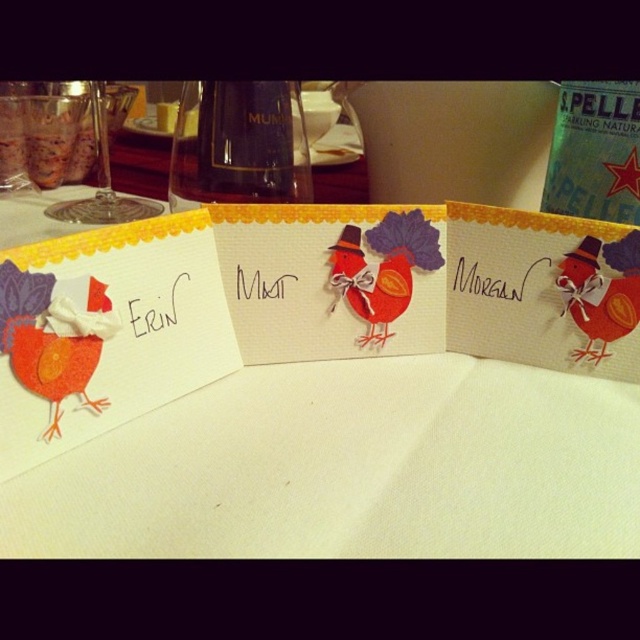
Question: Which object is the farthest from the black ink name at center?

Choices:
 (A) black ink name at upper left
 (B) matte orange felt chicken at left

Answer: (B)

Question: Can you confirm if white paper card at center is positioned below matte paper chicken at center?

Choices:
 (A) yes
 (B) no

Answer: (A)

Question: Is white paper card at center thinner than matte orange felt chicken at left?

Choices:
 (A) no
 (B) yes

Answer: (A)

Question: Which point appears farthest from the camera in this image?

Choices:
 (A) (241, 273)
 (B) (35, 417)

Answer: (A)

Question: Which object appears closest to the camera in this image?

Choices:
 (A) black ink name at upper left
 (B) matte paper chicken at center
 (C) black ink name at center

Answer: (A)

Question: In this image, where is matte paper card at left located relative to matte orange felt chicken at left?

Choices:
 (A) below
 (B) above

Answer: (B)